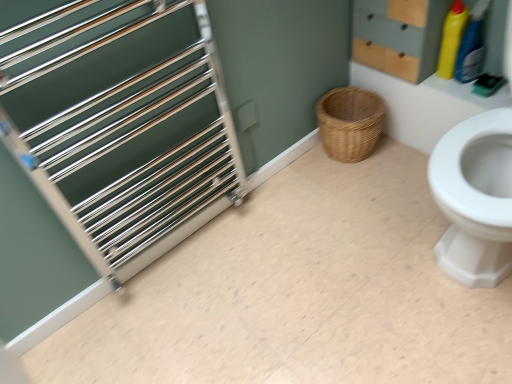
Where is `vacant space to the right of polished metal rack at left`? Image resolution: width=512 pixels, height=384 pixels. vacant space to the right of polished metal rack at left is located at coordinates (293, 238).